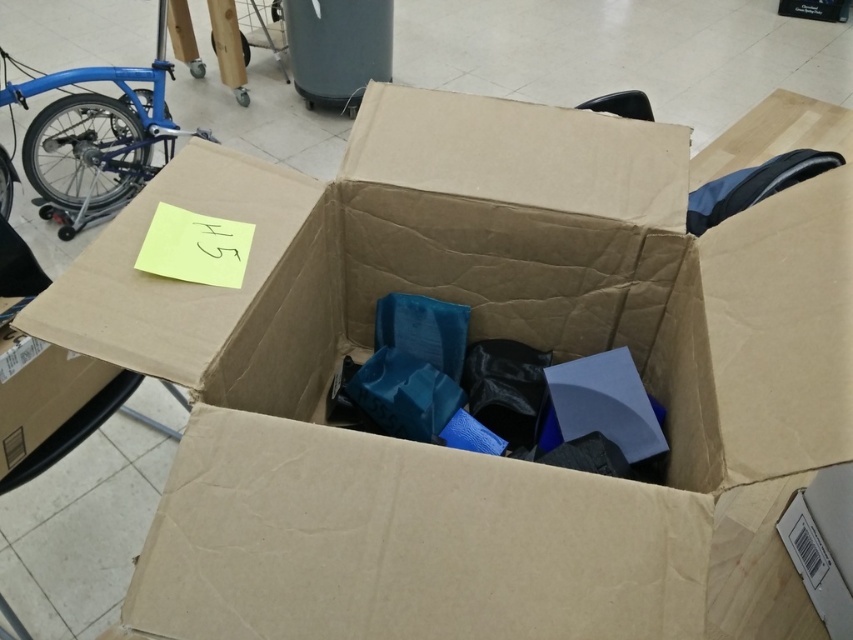
You are standing in a storage room and see the blue matte bicycle at left. If you want to move closer to it, how many steps should you take if each step covers 0.7 meters?

The distance between you and the blue matte bicycle at left is 2.28 meters. Each step covers 0.7 meters, so dividing 2.28 by 0.7 gives approximately 3.26 steps. Since you can only take whole steps, you would need to take 4 steps to reach the blue matte bicycle at left.

You are moving items into a storage room and need to stack the blue matte bicycle at left and the cardboard box at lower left. Based on their sizes, which one should be placed at the bottom to ensure stability?

The blue matte bicycle at left is taller than the cardboard box at lower left, so it should be placed at the bottom to ensure stability as taller items are usually placed lower for stability.

From the picture: You are moving items in a storage room and need to place a new item on the blue matte bicycle at left. Can you put it there without disturbing the cardboard box at lower left?

The blue matte bicycle at left is positioned over the cardboard box at lower left, so placing an item on the blue matte bicycle at left would require moving the cardboard box at lower left first to avoid disturbing it.